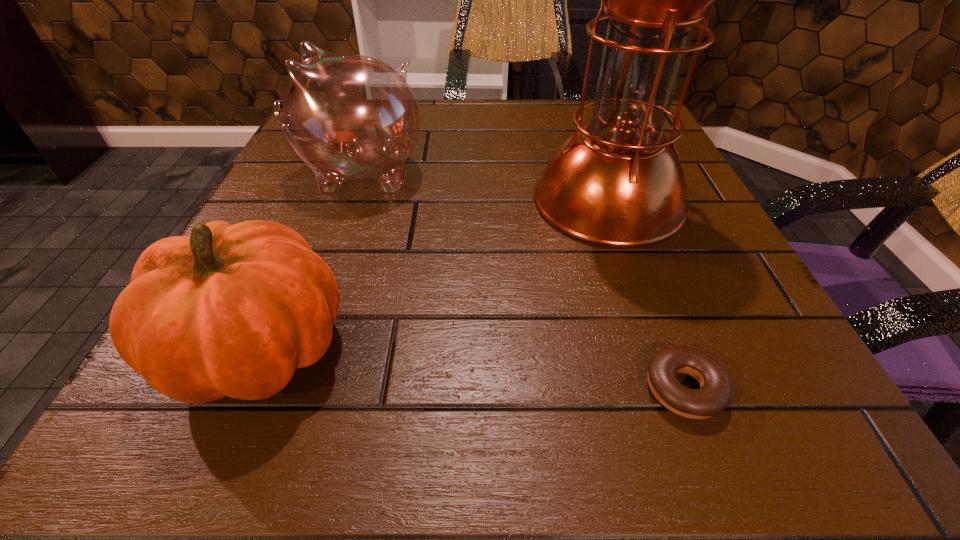
Identify the location of piggy bank at the left edge. (348, 117).

Where is `pumpkin positioned at the left edge`? pumpkin positioned at the left edge is located at coordinates (230, 310).

Identify the location of oil lamp that is at the right edge. (618, 182).

Identify the location of doughnut located at the right edge. The width and height of the screenshot is (960, 540). (714, 395).

At what (x,y) coordinates should I click in order to perform the action: click on object present at the far left corner. Please return your answer as a coordinate pair (x, y). This screenshot has width=960, height=540. Looking at the image, I should click on (348, 117).

Locate an element on the screen. Image resolution: width=960 pixels, height=540 pixels. object present at the near left corner is located at coordinates (230, 310).

The height and width of the screenshot is (540, 960). Identify the location of object that is positioned at the near right corner. (714, 395).

The image size is (960, 540). In the image, there is a desktop. What are the coordinates of `vacant area at the far edge` in the screenshot? It's located at (454, 111).

Where is `vacant position at the near edge of the desktop`? Image resolution: width=960 pixels, height=540 pixels. vacant position at the near edge of the desktop is located at coordinates (619, 391).

This screenshot has height=540, width=960. Find the location of `free region at the left edge`. free region at the left edge is located at coordinates (329, 257).